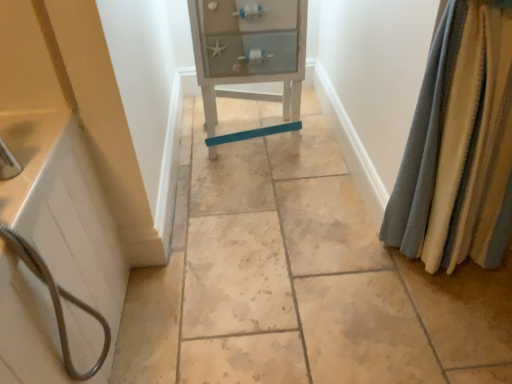
Question: Is white wood cabinet at center to the left of velvet-like beige curtains at right from the viewer's perspective?

Choices:
 (A) no
 (B) yes

Answer: (B)

Question: Can you confirm if white wood cabinet at center is positioned to the right of velvet-like beige curtains at right?

Choices:
 (A) no
 (B) yes

Answer: (A)

Question: Is white wood cabinet at center closer to the viewer compared to velvet-like beige curtains at right?

Choices:
 (A) no
 (B) yes

Answer: (A)

Question: Considering the relative sizes of white wood cabinet at center and velvet-like beige curtains at right in the image provided, is white wood cabinet at center smaller than velvet-like beige curtains at right?

Choices:
 (A) no
 (B) yes

Answer: (A)

Question: Is the depth of white wood cabinet at center greater than that of velvet-like beige curtains at right?

Choices:
 (A) yes
 (B) no

Answer: (A)

Question: Would you say velvet-like beige curtains at right is inside or outside white matte bathtub at left?

Choices:
 (A) outside
 (B) inside

Answer: (A)

Question: Considering the positions of velvet-like beige curtains at right and white matte bathtub at left in the image, is velvet-like beige curtains at right taller or shorter than white matte bathtub at left?

Choices:
 (A) tall
 (B) short

Answer: (A)

Question: From a real-world perspective, relative to white matte bathtub at left, is velvet-like beige curtains at right vertically above or below?

Choices:
 (A) above
 (B) below

Answer: (B)

Question: Looking at the image, does velvet-like beige curtains at right seem bigger or smaller compared to white matte bathtub at left?

Choices:
 (A) small
 (B) big

Answer: (A)

Question: From the image's perspective, is white wood cabinet at center located above or below white matte bathtub at left?

Choices:
 (A) below
 (B) above

Answer: (B)

Question: Is white wood cabinet at center in front of or behind white matte bathtub at left in the image?

Choices:
 (A) front
 (B) behind

Answer: (B)

Question: Based on their positions, is white wood cabinet at center located to the left or right of white matte bathtub at left?

Choices:
 (A) left
 (B) right

Answer: (B)

Question: From a real-world perspective, is white wood cabinet at center positioned above or below white matte bathtub at left?

Choices:
 (A) below
 (B) above

Answer: (A)

Question: Does point click(x=31, y=380) appear closer or farther from the camera than point click(x=245, y=4)?

Choices:
 (A) farther
 (B) closer

Answer: (B)

Question: Based on their sizes in the image, would you say white matte bathtub at left is bigger or smaller than white wood cabinet at center?

Choices:
 (A) big
 (B) small

Answer: (B)